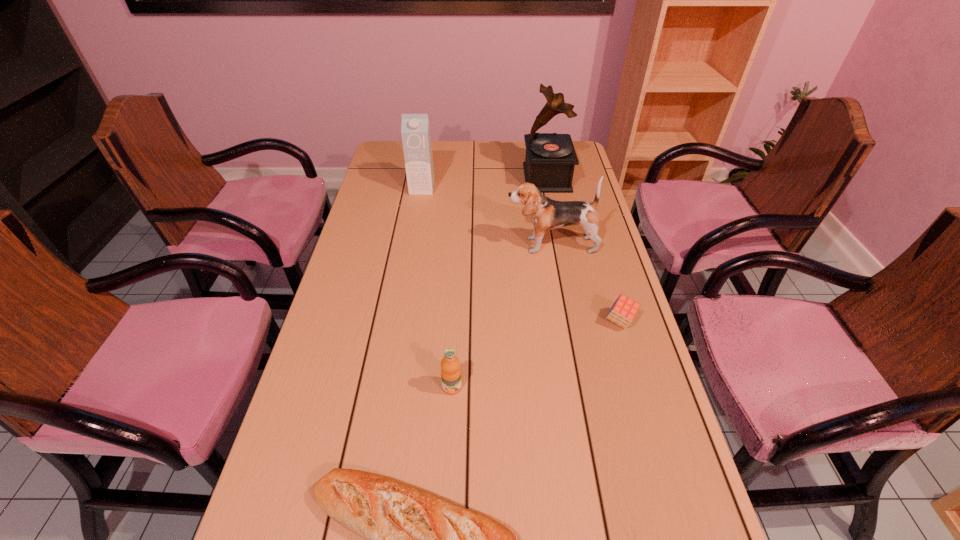
Where is `object present at the far right corner`? The width and height of the screenshot is (960, 540). object present at the far right corner is located at coordinates (550, 159).

Find the location of a particular element. The image size is (960, 540). blank area at the far edge is located at coordinates tap(479, 145).

Find the location of a particular element. The width and height of the screenshot is (960, 540). free space at the left edge is located at coordinates (350, 297).

Locate an element on the screen. The height and width of the screenshot is (540, 960). blank space at the right edge of the desktop is located at coordinates (565, 245).

Where is `vacant area that lies between the orange juice and the carton`? vacant area that lies between the orange juice and the carton is located at coordinates (437, 288).

In order to click on free space between the tallest object and the third shortest object in this screenshot , I will do `click(499, 282)`.

Locate an element on the screen. The width and height of the screenshot is (960, 540). free spot between the tallest object and the carton is located at coordinates 485,183.

The width and height of the screenshot is (960, 540). Identify the location of vacant area that lies between the fourth nearest object and the fourth tallest object. (502, 316).

This screenshot has width=960, height=540. Identify the location of empty space between the carton and the phonograph_record. (485, 183).

Image resolution: width=960 pixels, height=540 pixels. In order to click on vacant area that lies between the cube and the carton in this screenshot , I will do `click(521, 255)`.